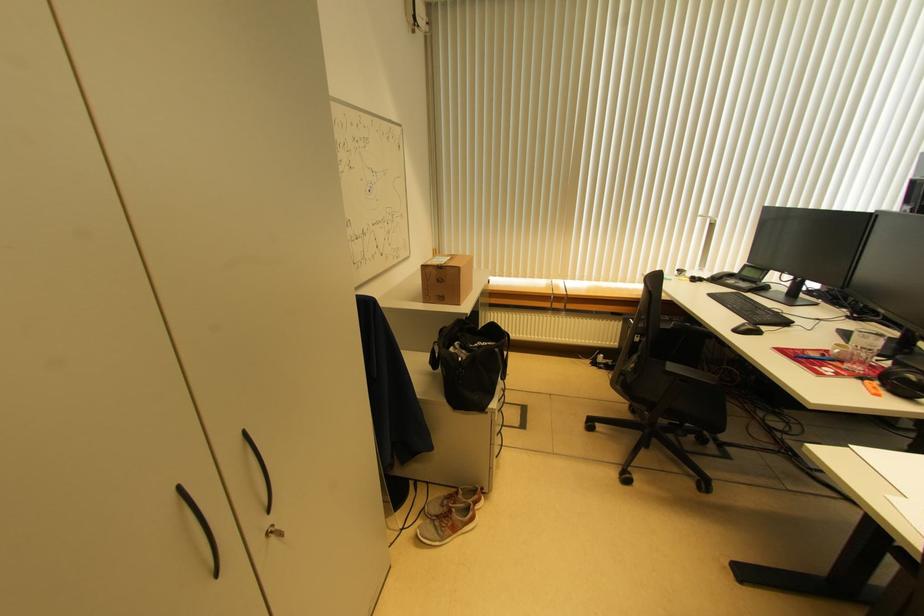
This screenshot has height=616, width=924. What do you see at coordinates (742, 278) in the screenshot? I see `the telephone handset` at bounding box center [742, 278].